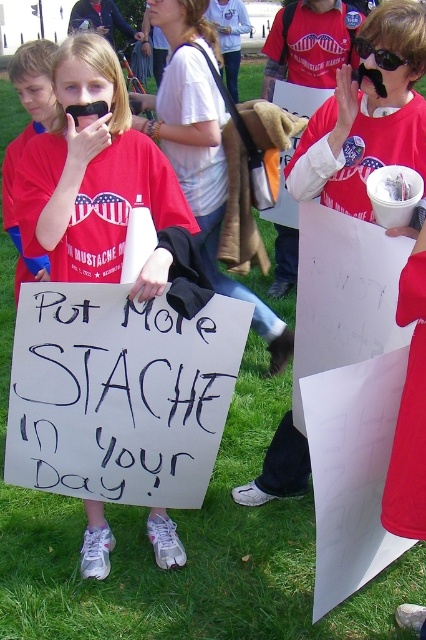
What is the color of the tshirt at the point with coordinates (92, 172)?

The point at coordinates (92, 172) corresponds to a matte red tshirt at center, so the color is red.